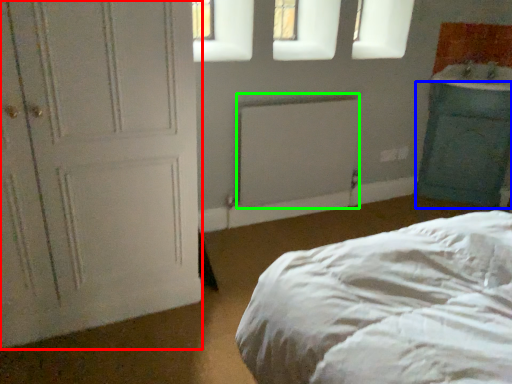
Question: Which object is the farthest from door (highlighted by a red box)? Choose among these: cabinetry (highlighted by a blue box) or radiator (highlighted by a green box).

Choices:
 (A) cabinetry
 (B) radiator

Answer: (A)